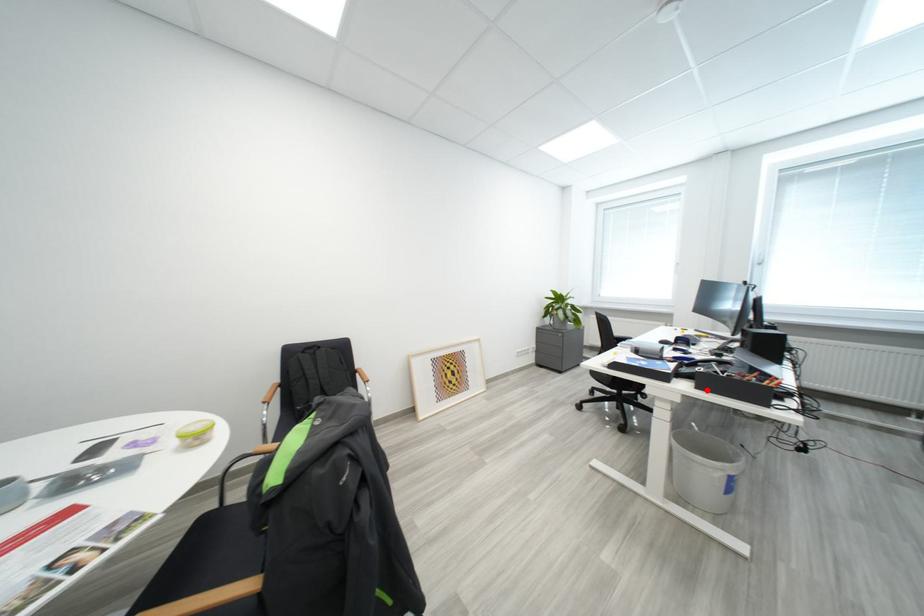
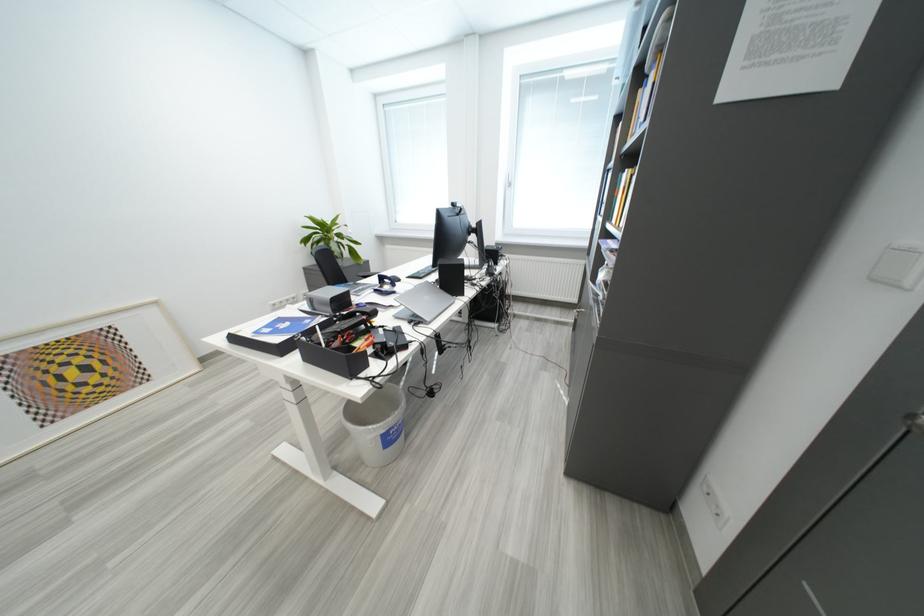
The point at the highlighted location is marked in the first image. Where is the corresponding point in the second image?

(315, 362)